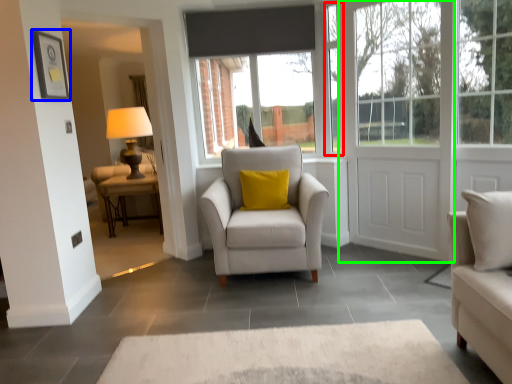
Question: Estimate the real-world distances between objects in this image. Which object is farther from window frame (highlighted by a red box), picture frame (highlighted by a blue box) or door (highlighted by a green box)?

Choices:
 (A) picture frame
 (B) door

Answer: (A)